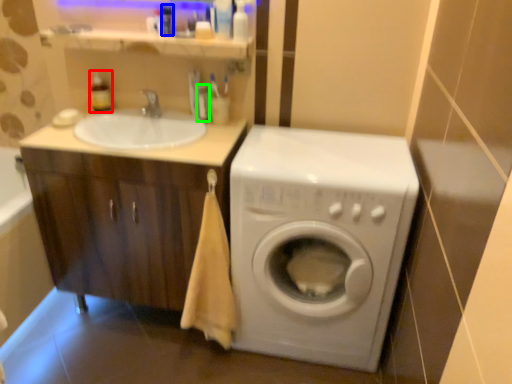
Question: Which is farther away from toiletry (highlighted by a red box)? toiletry (highlighted by a blue box) or toiletry (highlighted by a green box)?

Choices:
 (A) toiletry
 (B) toiletry

Answer: (B)